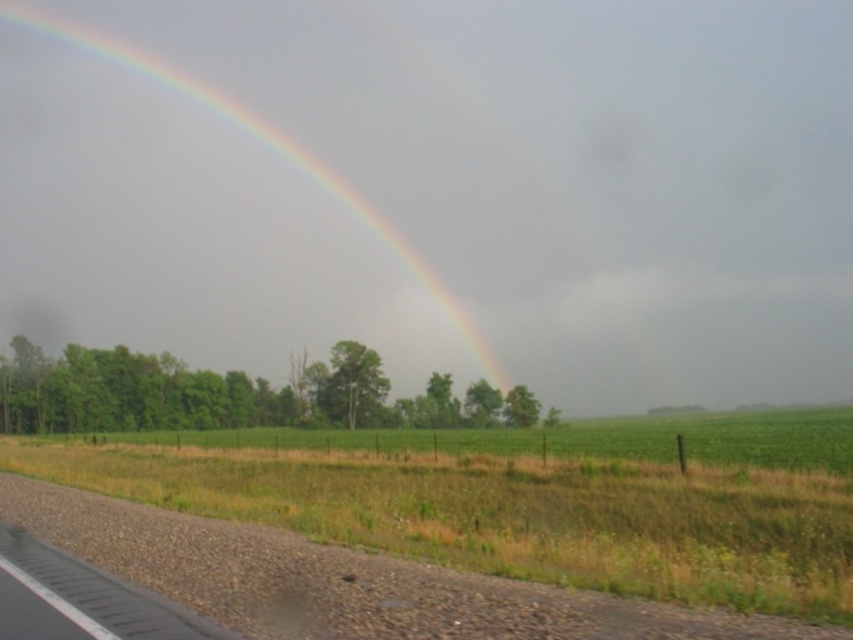
Which is more to the right, rainbow at upper center or green grass at lower center?

green grass at lower center is more to the right.

Which is below, rainbow at upper center or green grass at lower center?

green grass at lower center is below.

You are a GUI agent. You are given a task and a screenshot of the screen. Output one action in this format:
    pyautogui.click(x=<x>, y=<y>)
    Task: Click on the rainbow at upper center
    
    Given the screenshot: What is the action you would take?
    pyautogui.click(x=195, y=216)

This screenshot has height=640, width=853. I want to click on rainbow at upper center, so click(195, 216).